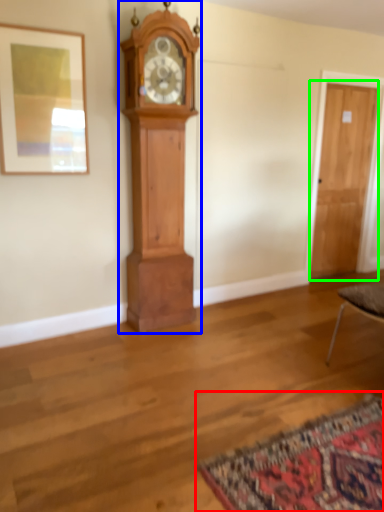
Question: Considering the real-world distances, which object is farthest from mat (highlighted by a red box)? wall clock (highlighted by a blue box) or door (highlighted by a green box)?

Choices:
 (A) wall clock
 (B) door

Answer: (B)